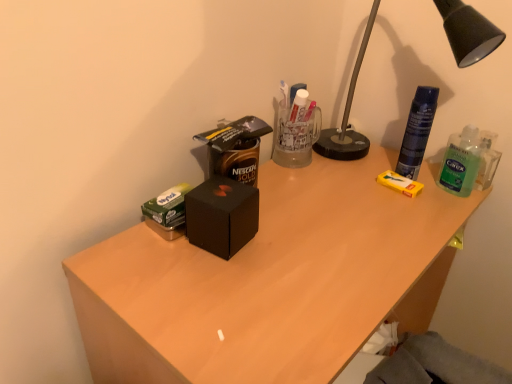
Identify the location of empty space that is in between black metal lamp at upper right and black matte box at center. (326, 204).